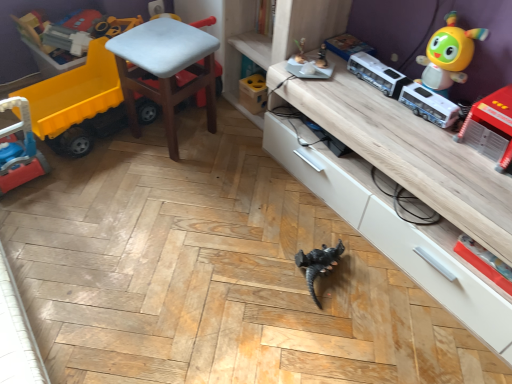
Identify the location of vacant space positioned to the left of wooden block at center, which is the fourth toy in right-to-left order. The width and height of the screenshot is (512, 384). (226, 107).